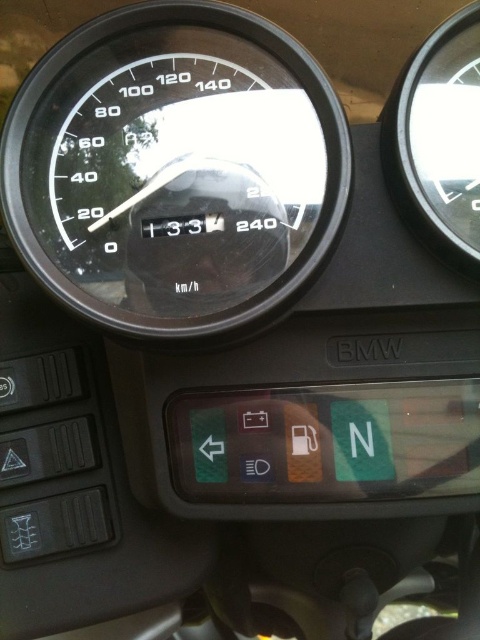
Who is more distant from viewer, (10, 209) or (464, 97)?

Positioned behind is point (464, 97).

Does black glass speedometer at center have a lesser height compared to transparent glass speedometer at upper right?

No, black glass speedometer at center is not shorter than transparent glass speedometer at upper right.

I want to click on black glass speedometer at center, so click(169, 168).